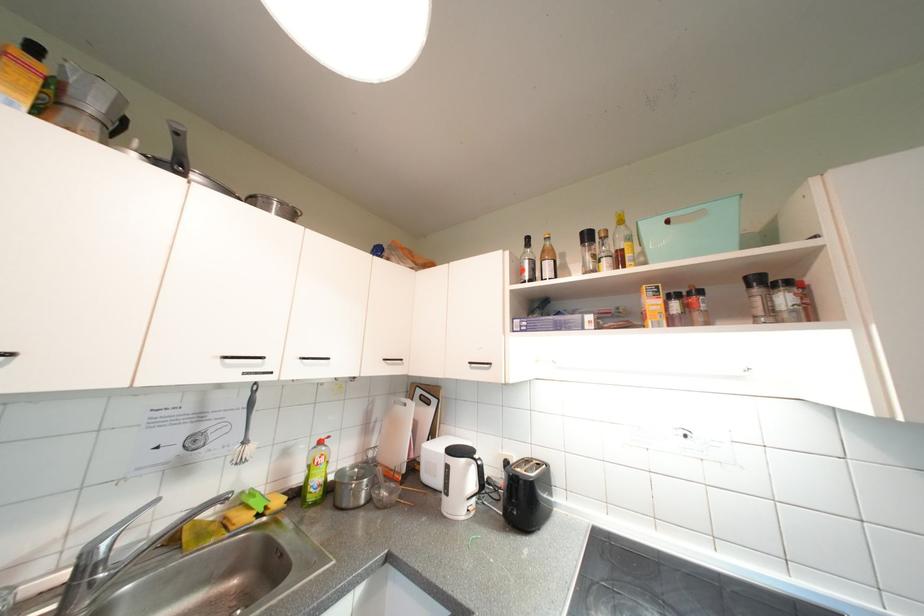
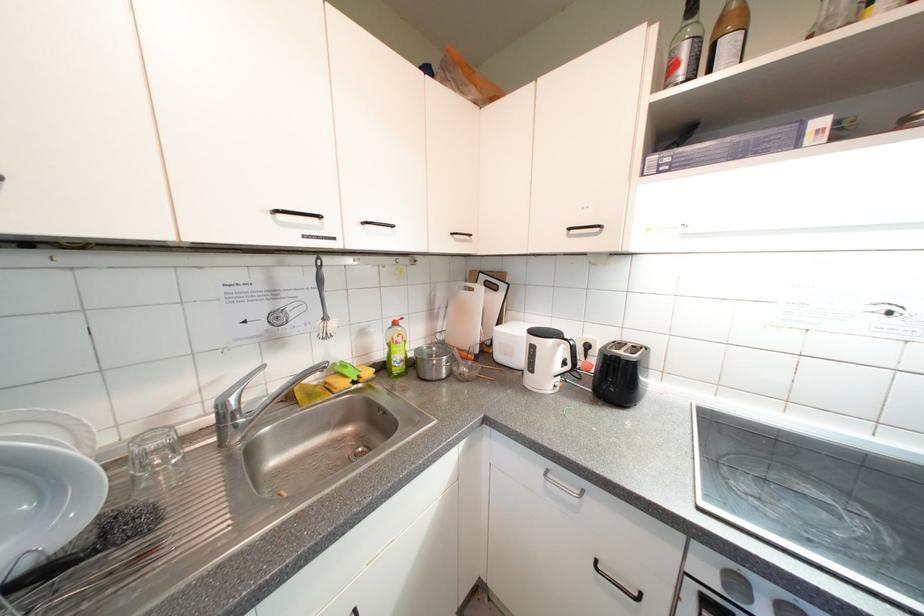
Find the pixel in the second image that matches the point at 530,273 in the first image.

(683, 68)